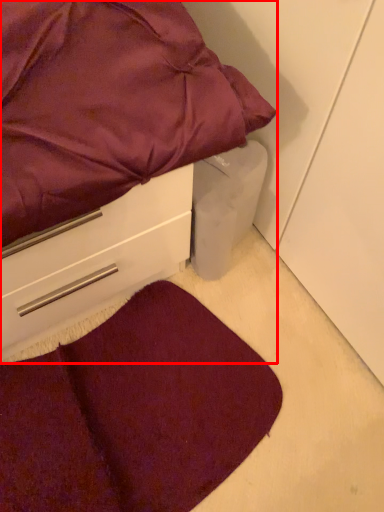
Question: Where is bed (annotated by the red box) located in relation to mat in the image?

Choices:
 (A) left
 (B) right

Answer: (A)